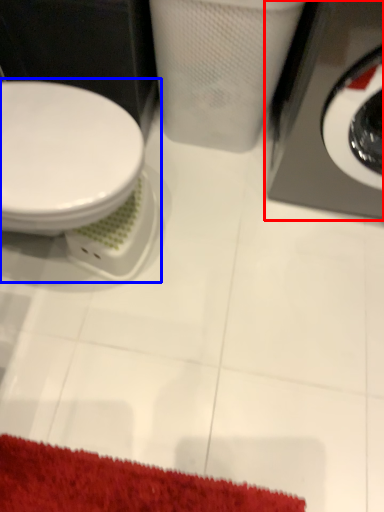
Question: Which object is further to the camera taking this photo, washing machine (highlighted by a red box) or toilet (highlighted by a blue box)?

Choices:
 (A) washing machine
 (B) toilet

Answer: (B)